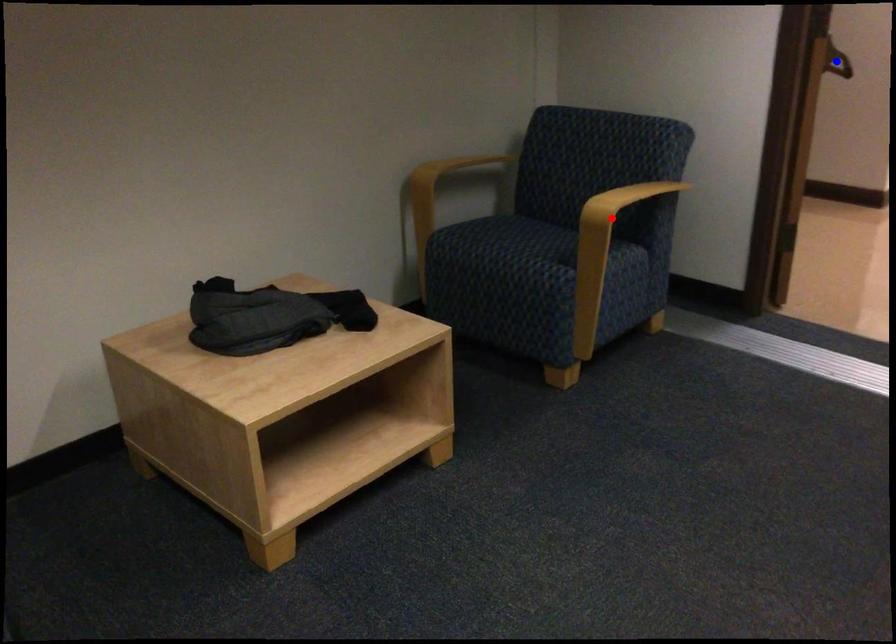
Question: Two points are marked on the image. Which point is closer to the camera?

Choices:
 (A) Blue point is closer.
 (B) Red point is closer.

Answer: (B)